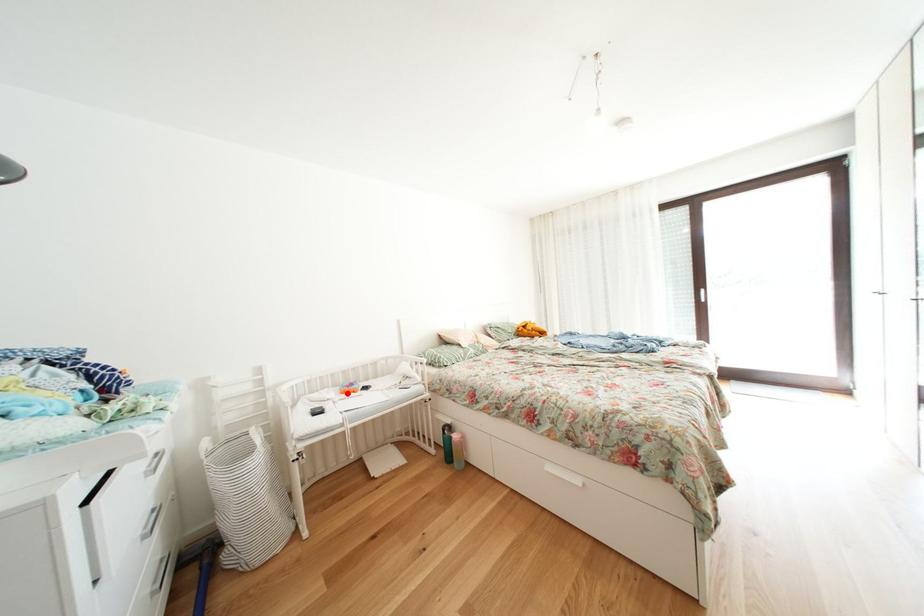
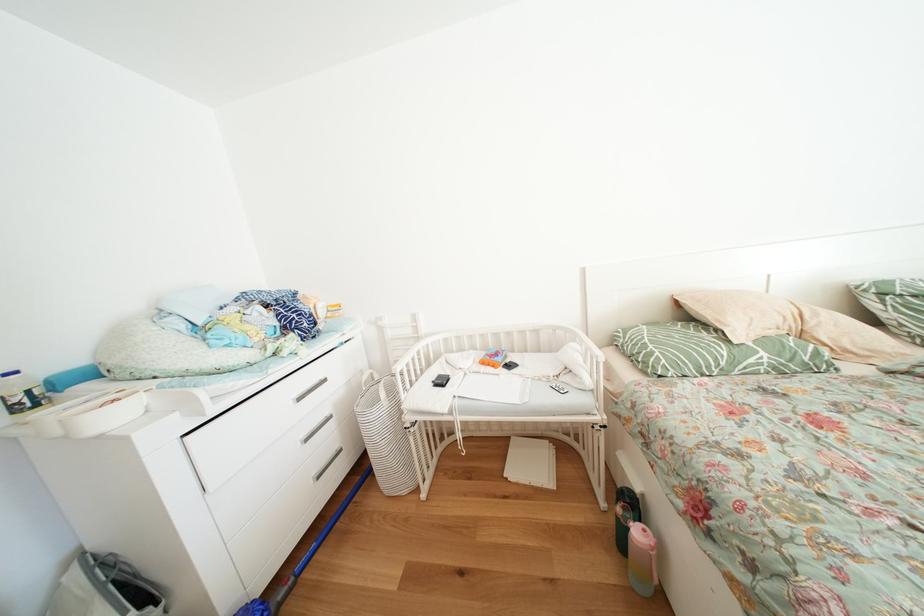
Locate, in the second image, the point that corresponds to the highlighted location in the first image.

(491, 360)